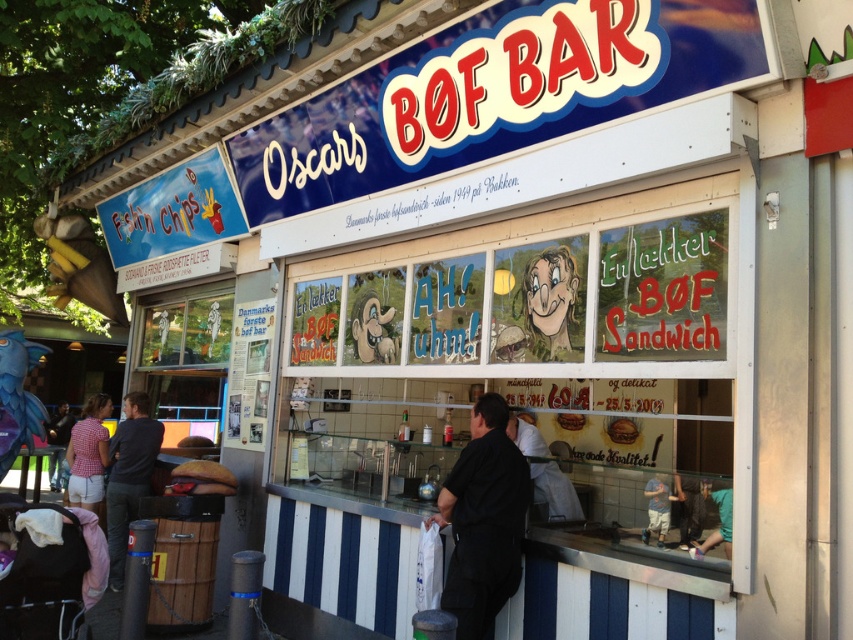
Can you confirm if dark gray shirt at left is positioned above plaid shirt at lower left?

Correct, dark gray shirt at left is located above plaid shirt at lower left.

Does point (109, 529) come closer to viewer compared to point (61, 440)?

Yes, point (109, 529) is in front of point (61, 440).

Who is more forward, (137, 400) or (59, 404)?

Positioned in front is point (137, 400).

Locate an element on the screen. dark gray shirt at left is located at coordinates (128, 476).

Between black matte shirt at center and golden bread at center, which one is positioned lower?

Positioned lower is black matte shirt at center.

Can you confirm if black matte shirt at center is positioned to the left of golden bread at center?

Yes, black matte shirt at center is to the left of golden bread at center.

Is point (502, 506) in front of point (612, 424)?

Yes, point (502, 506) is in front of point (612, 424).

Image resolution: width=853 pixels, height=640 pixels. I want to click on black matte shirt at center, so click(483, 518).

Is light gray shirt at center smaller than plaid shirt at lower left?

Yes.

Who is taller, light gray shirt at center or plaid shirt at lower left?

Standing taller between the two is plaid shirt at lower left.

Is point (560, 483) positioned after point (57, 412)?

No, (560, 483) is closer to viewer.

What are the coordinates of `light gray shirt at center` in the screenshot? It's located at (554, 492).